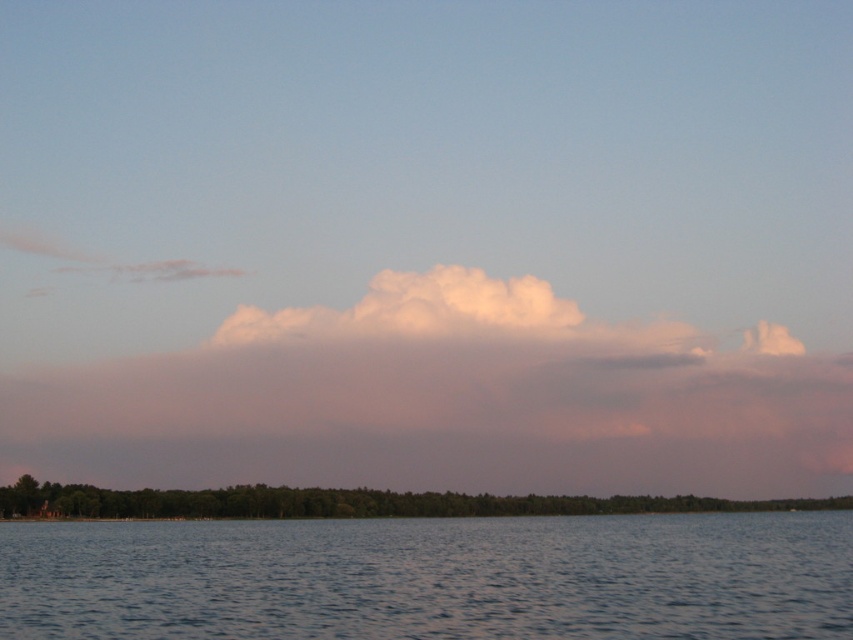
Question: Is clear water at lower center smaller than green leafy trees at lower center?

Choices:
 (A) no
 (B) yes

Answer: (A)

Question: Among these objects, which one is nearest to the camera?

Choices:
 (A) white fluffy cloud at center
 (B) clear water at lower center

Answer: (B)

Question: Observing the image, what is the correct spatial positioning of white fluffy cloud at center in reference to green leafy trees at lower center?

Choices:
 (A) right
 (B) left

Answer: (A)

Question: Which of the following is the closest to the observer?

Choices:
 (A) (277, 513)
 (B) (128, 618)
 (C) (376, 275)

Answer: (B)

Question: Is white fluffy cloud at center further to camera compared to green leafy trees at lower center?

Choices:
 (A) yes
 (B) no

Answer: (A)

Question: Estimate the real-world distances between objects in this image. Which object is closer to the white fluffy cloud at center?

Choices:
 (A) green leafy trees at lower center
 (B) clear water at lower center

Answer: (A)